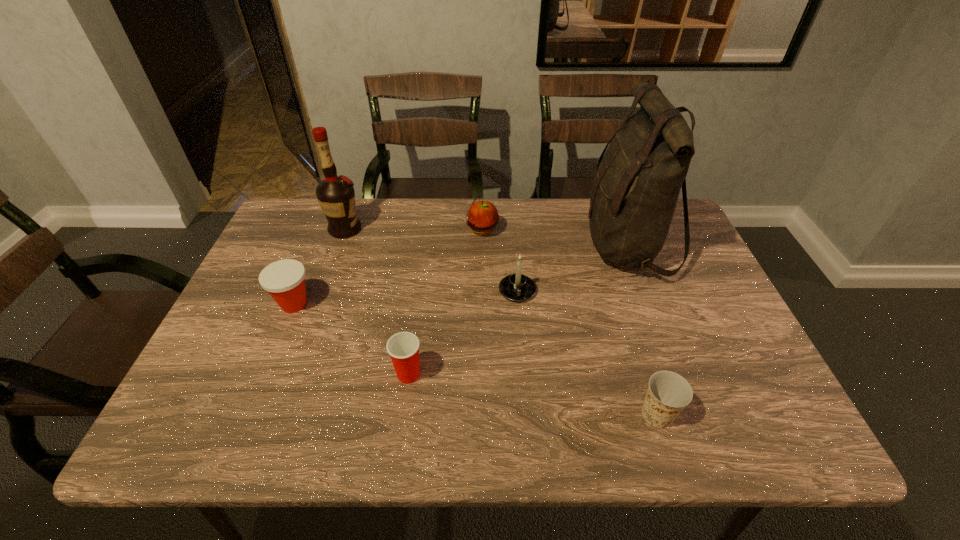
This screenshot has width=960, height=540. What are the coordinates of `free space that is in between the sixth shortest object and the candle holder` in the screenshot? It's located at (431, 260).

Locate which object is the closest to the nearest Dixie cup. Please provide its 2D coordinates. Your answer should be formatted as a tuple, i.e. [(x, y)], where the tuple contains the x and y coordinates of a point satisfying the conditions above.

[(517, 287)]

Identify which object is the second nearest to the farthest Dixie cup. Please provide its 2D coordinates. Your answer should be formatted as a tuple, i.e. [(x, y)], where the tuple contains the x and y coordinates of a point satisfying the conditions above.

[(403, 348)]

Identify which Dixie cup is located as the nearest to the rightmost Dixie cup. Please provide its 2D coordinates. Your answer should be formatted as a tuple, i.e. [(x, y)], where the tuple contains the x and y coordinates of a point satisfying the conditions above.

[(403, 348)]

Where is `Dixie cup that is the closest one to the farthest Dixie cup`? The height and width of the screenshot is (540, 960). Dixie cup that is the closest one to the farthest Dixie cup is located at coordinates (403, 348).

The width and height of the screenshot is (960, 540). Find the location of `free space in the image that satisfies the following two spatial constraints: 1. on the front side of the apple; 2. on the left side of the nearest object`. free space in the image that satisfies the following two spatial constraints: 1. on the front side of the apple; 2. on the left side of the nearest object is located at coordinates pyautogui.click(x=484, y=414).

This screenshot has width=960, height=540. I want to click on free space that satisfies the following two spatial constraints: 1. on the front side of the nearest Dixie cup; 2. on the left side of the second farthest Dixie cup, so click(x=403, y=414).

Where is `vacant space that satisfies the following two spatial constraints: 1. on the open flap of the backpack; 2. on the front side of the farthest Dixie cup`? Image resolution: width=960 pixels, height=540 pixels. vacant space that satisfies the following two spatial constraints: 1. on the open flap of the backpack; 2. on the front side of the farthest Dixie cup is located at coordinates (649, 304).

Image resolution: width=960 pixels, height=540 pixels. Find the location of `free spot that satisfies the following two spatial constraints: 1. on the open flap of the backpack; 2. with a handle on the side of the candle holder`. free spot that satisfies the following two spatial constraints: 1. on the open flap of the backpack; 2. with a handle on the side of the candle holder is located at coordinates (643, 291).